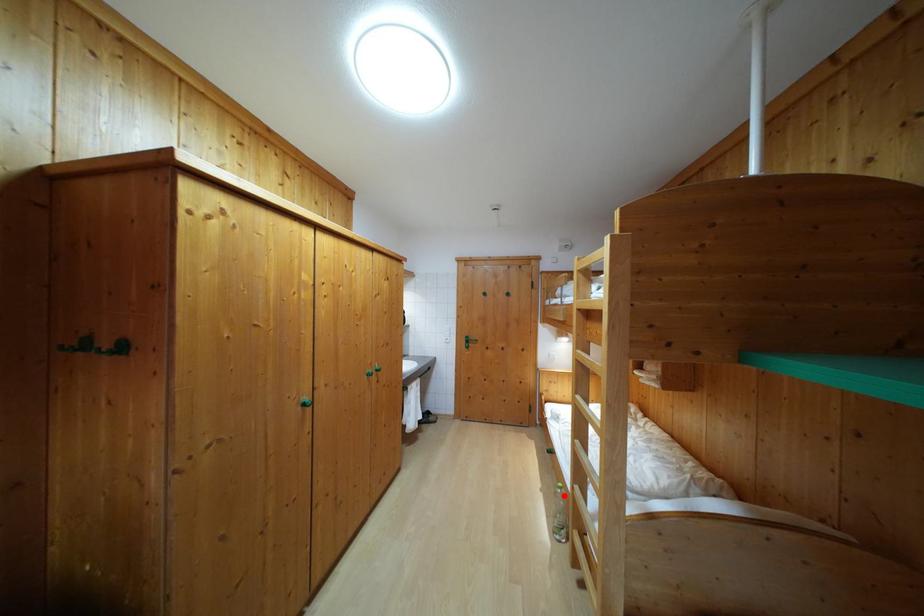
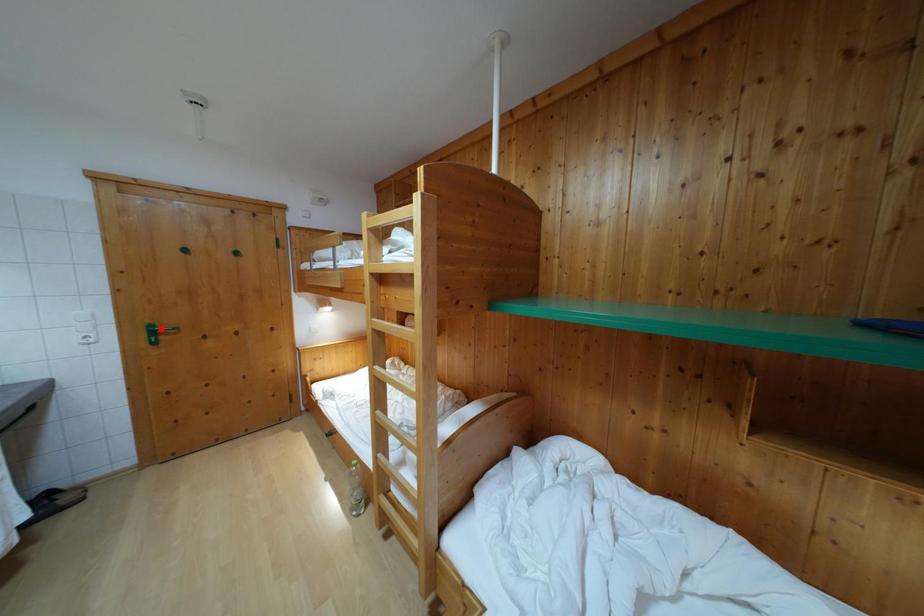
I am providing you with two images of the same scene from different viewpoints. A red point is marked on the first image and another point is marked on the second image. Are the points marked in image1 and image2 representing the same 3D position?

No